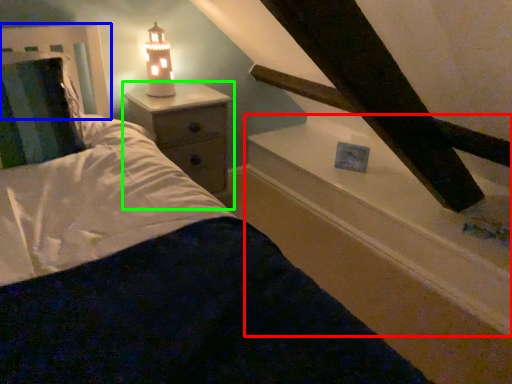
Question: Considering the real-world distances, which object is farthest from window sill (highlighted by a red box)? headboard (highlighted by a blue box) or nightstand (highlighted by a green box)?

Choices:
 (A) headboard
 (B) nightstand

Answer: (A)